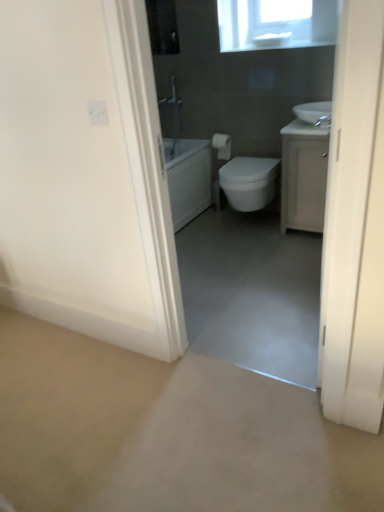
Identify the location of free space above smooth concrete floor at center (from a real-world perspective). Image resolution: width=384 pixels, height=512 pixels. (170, 391).